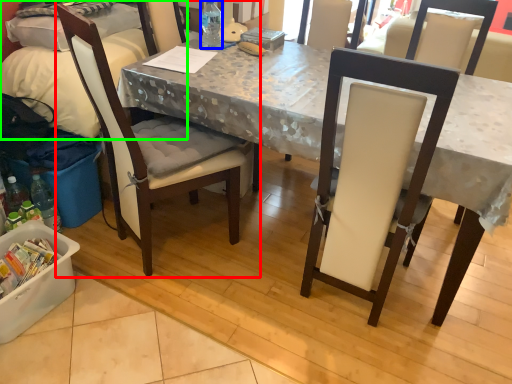
Question: Which object is positioned farthest from chair (highlighted by a red box)? Select from bottle (highlighted by a blue box) and leftover (highlighted by a green box).

Choices:
 (A) bottle
 (B) leftover

Answer: (A)